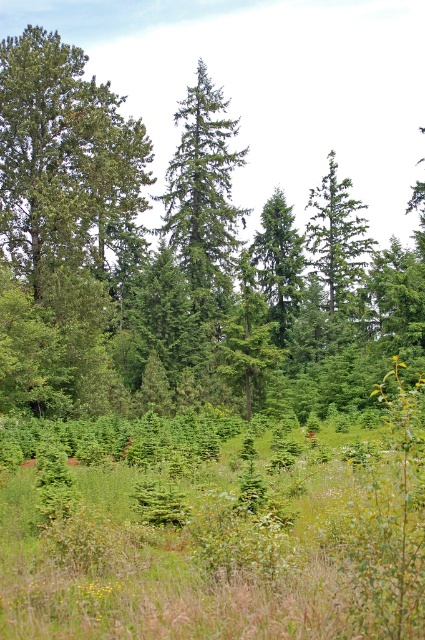
You are a bird flying over the forest and want to land on a tree. You see the green matte tree at upper right and the green matte tree at center. Which tree is closer to the ground?

The green matte tree at upper right is below the green matte tree at center, so it is closer to the ground.

You are a hiker who wants to take a photo of the green matte tree at upper right and the green matte tree at center from a position where both are visible. Based on their heights, which tree will appear taller in the photo?

The green matte tree at upper right has a greater height compared to the green matte tree at center, so it will appear taller in the photo.